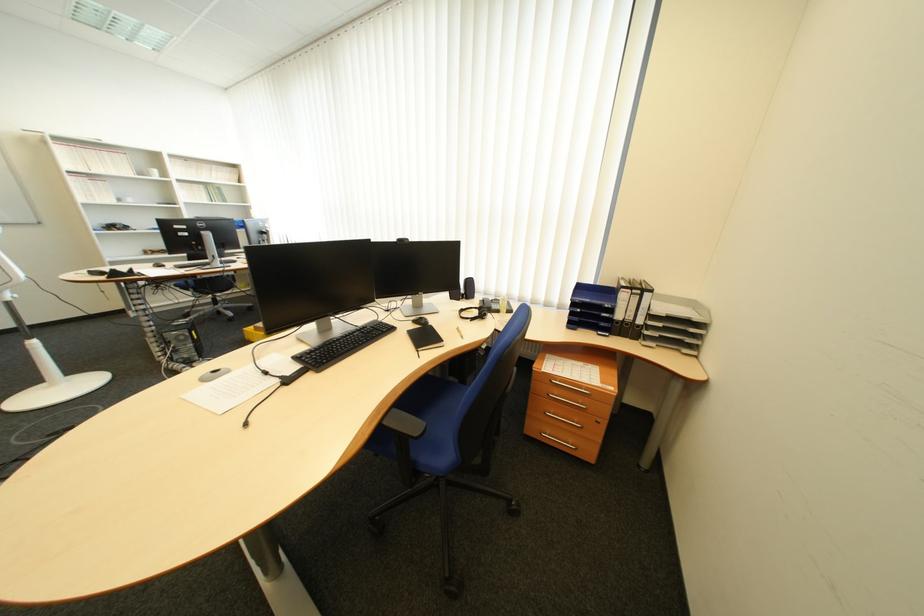
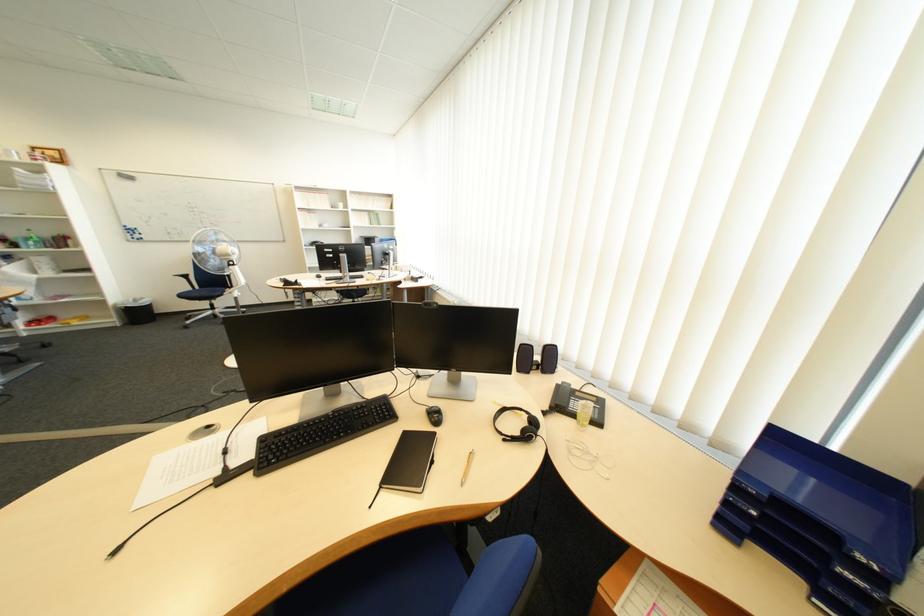
The point at (x=476, y=299) is marked in the first image. Where is the corresponding point in the second image?

(551, 370)